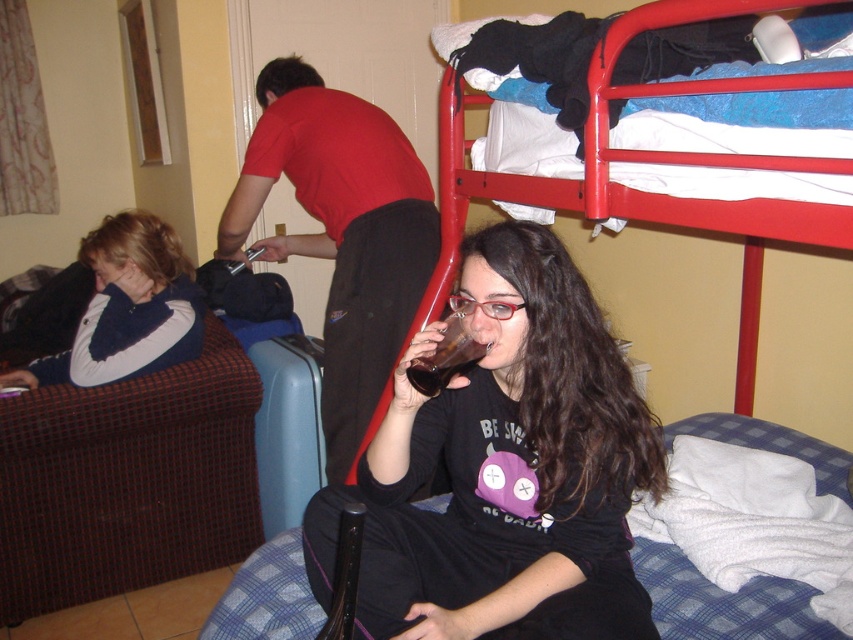
Question: Is matte black shirt at center further to the viewer compared to translucent glass at center?

Choices:
 (A) yes
 (B) no

Answer: (B)

Question: Which object is farther from the camera taking this photo?

Choices:
 (A) matte red shirt at center
 (B) translucent glass at center
 (C) red metal bunk bed at upper right

Answer: (A)

Question: Estimate the real-world distances between objects in this image. Which object is closer to the matte black shirt at center?

Choices:
 (A) red metal bunk bed at upper right
 (B) translucent glass at center
 (C) blue fleece jacket at left
 (D) matte red shirt at center

Answer: (B)

Question: Can you confirm if matte red shirt at center is positioned below translucent glass at center?

Choices:
 (A) no
 (B) yes

Answer: (A)

Question: Which point is closer to the camera taking this photo?

Choices:
 (A) (144, 234)
 (B) (442, 220)

Answer: (B)

Question: Is matte black shirt at center positioned before red metal bunk bed at upper right?

Choices:
 (A) yes
 (B) no

Answer: (B)